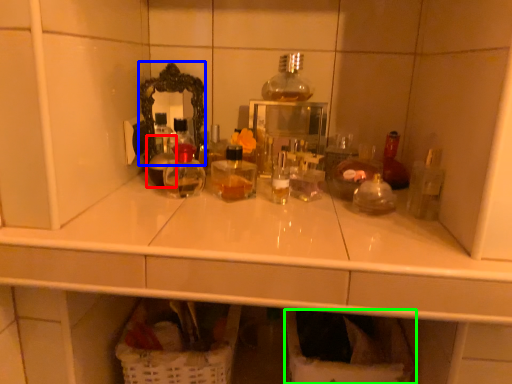
Question: Estimate the real-world distances between objects in this image. Which object is closer to bottle (highlighted by a red box), mirror (highlighted by a blue box) or laundry basket (highlighted by a green box)?

Choices:
 (A) mirror
 (B) laundry basket

Answer: (A)